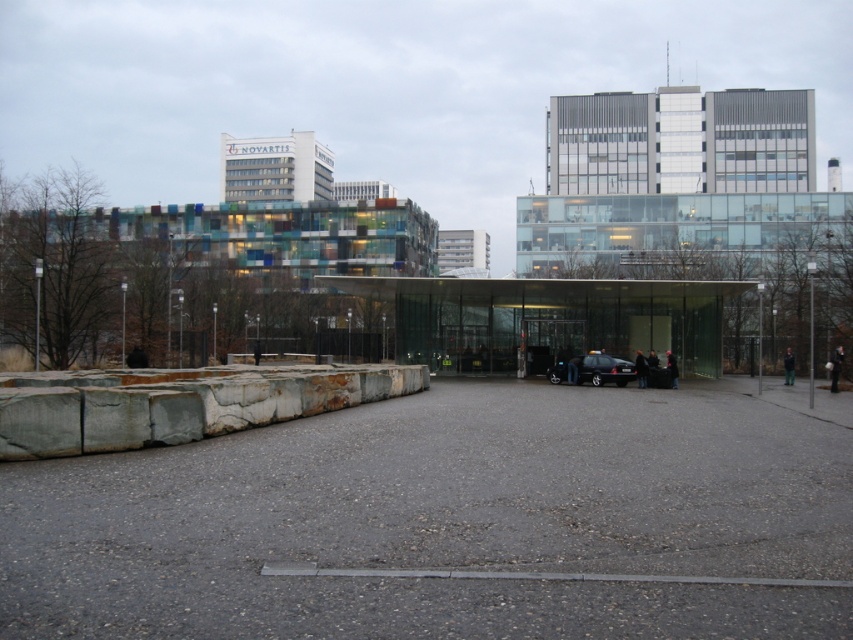
You are standing at the edge of the gray asphalt parking lot at center and want to throw a frisbee to your friend who is 5.5 meters away from you. Can you reach them with one throw?

The gray asphalt parking lot at center and viewer are 5.10 meters apart, so the distance between you and your friend is 5.5 meters, which is slightly farther than the parking lot to viewer distance. You might need a stronger throw or take a step forward to reach them.

You are a delivery person trying to park your black metallic car at center in the gray asphalt parking lot at center. The parking space is 20 feet long. Can your car fit into the parking space?

The distance between the gray asphalt parking lot at center and the black metallic car at center is 63.18 feet, which is much longer than the 20 feet parking space. Therefore, the car cannot fit into the parking space.

You are a delivery person trying to park your black metallic car at center in the gray asphalt parking lot at center. The parking spot is exactly the width of the parking lot. Will your car fit perfectly in the parking spot?

The gray asphalt parking lot at center is wider than the black metallic car at center, so the car will fit with some space to spare.